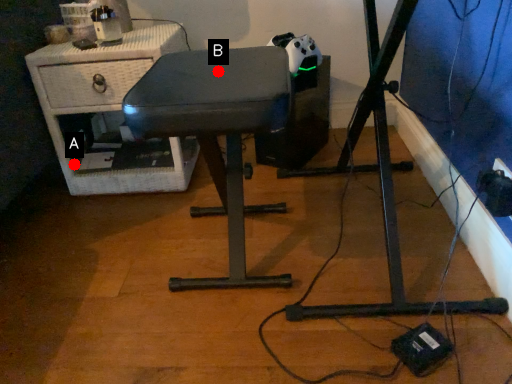
Question: Two points are circled on the image, labeled by A and B beside each circle. Which point is closer to the camera?

Choices:
 (A) A is closer
 (B) B is closer

Answer: (B)